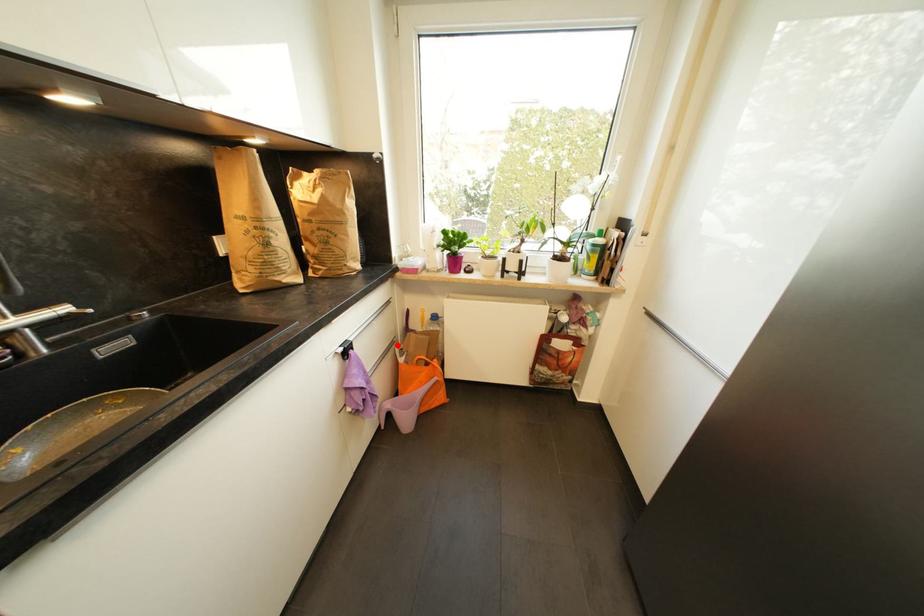
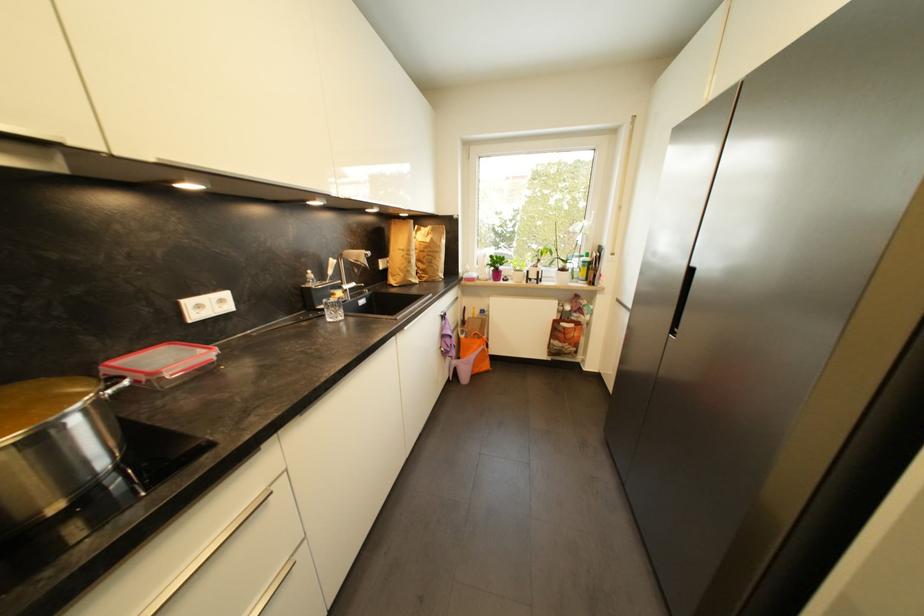
Locate, in the second image, the point that corresponds to the highlighted location in the first image.

(463, 328)